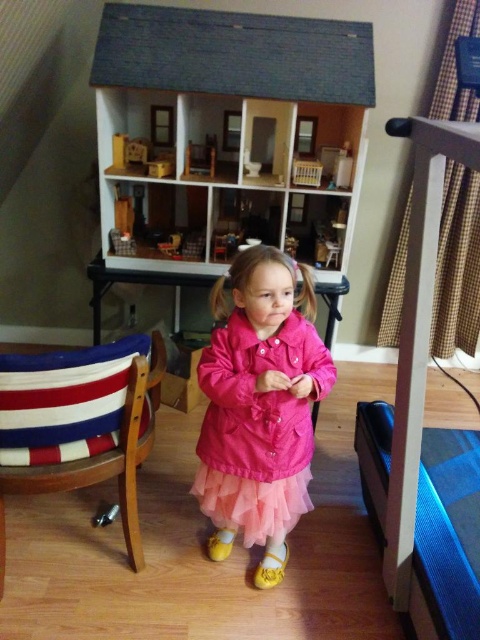
Does point (300, 458) lie behind point (132, 552)?

No.

Find the location of a particular element. The image size is (480, 640). pink matte coat at center is located at coordinates (261, 410).

Where is `pink matte coat at center`? The image size is (480, 640). pink matte coat at center is located at coordinates (261, 410).

Based on the photo, which is more to the right, striped fabric chair at lower left or pink tulle skirt at center?

From the viewer's perspective, pink tulle skirt at center appears more on the right side.

Which is behind, point (132, 528) or point (260, 509)?

Point (260, 509)

Locate an element on the screen. The width and height of the screenshot is (480, 640). striped fabric chair at lower left is located at coordinates (100, 460).

Does blue fabric bunk bed at right appear under pink tulle skirt at center?

No.

Does point (386, 568) come closer to viewer compared to point (245, 538)?

That is True.

Image resolution: width=480 pixels, height=640 pixels. In order to click on blue fabric bunk bed at right in this screenshot , I will do `click(418, 417)`.